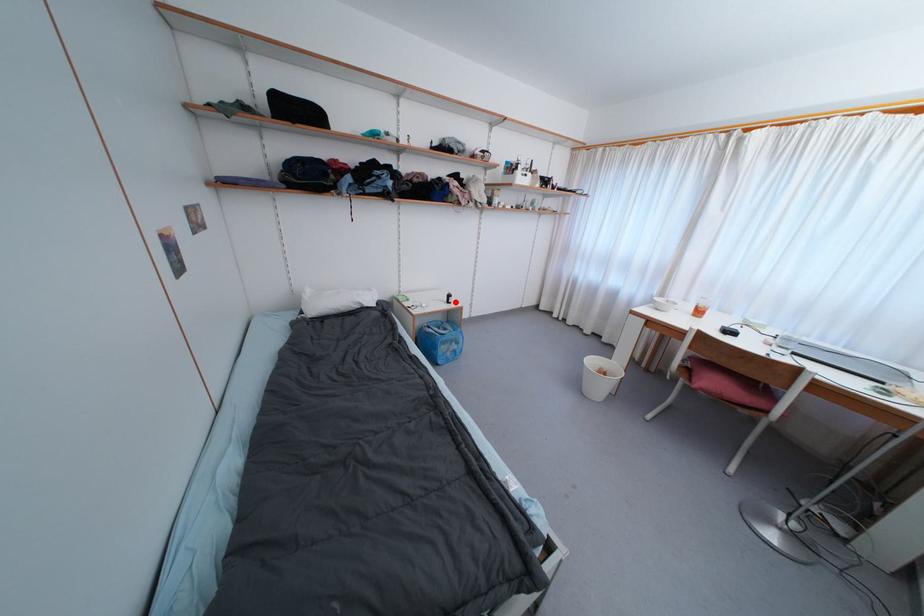
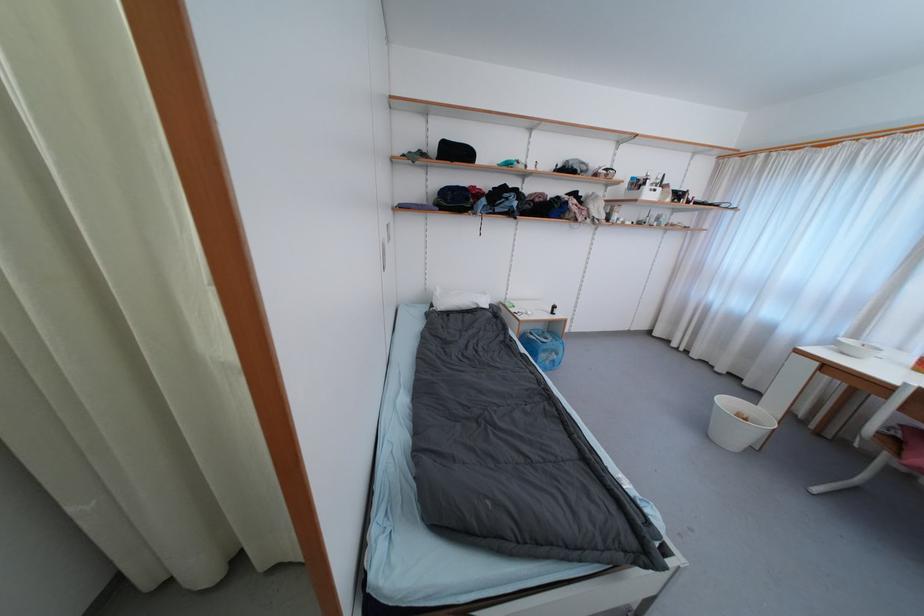
In the second image, find the point that corresponds to the highlighted location in the first image.

(560, 313)